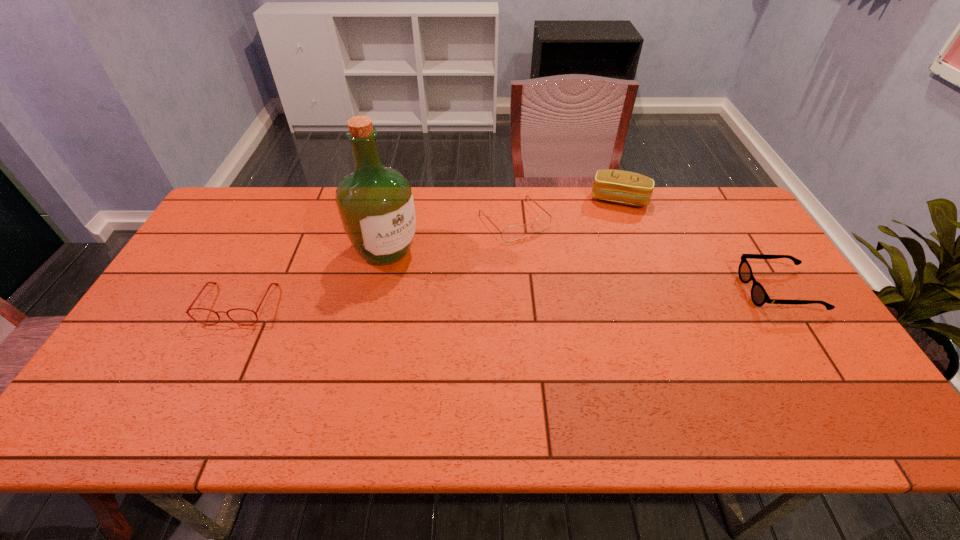
You are a GUI agent. You are given a task and a screenshot of the screen. Output one action in this format:
    pyautogui.click(x=<x>, y=<y>)
    Task: Click on the free region located 0.370m on the arms of the rightmost spectacles
    
    Given the screenshot: What is the action you would take?
    pyautogui.click(x=614, y=291)

Where is `vacant space positioned 0.260m on the arms of the rightmost spectacles`? Image resolution: width=960 pixels, height=540 pixels. vacant space positioned 0.260m on the arms of the rightmost spectacles is located at coordinates (654, 291).

Locate an element on the screen. This screenshot has width=960, height=540. free location located 0.080m on the front-facing side of the third object from right to left is located at coordinates (546, 255).

Image resolution: width=960 pixels, height=540 pixels. I want to click on blank space located 0.180m on the front-facing side of the third object from right to left, so click(x=565, y=276).

Where is `vacant space located 0.070m on the front-facing side of the third object from right to left`? This screenshot has height=540, width=960. vacant space located 0.070m on the front-facing side of the third object from right to left is located at coordinates (545, 253).

You are a GUI agent. You are given a task and a screenshot of the screen. Output one action in this format:
    pyautogui.click(x=<x>, y=<y>)
    Task: Click on the vacant space located 0.270m on the front-facing side of the tallest object
    
    Given the screenshot: What is the action you would take?
    (x=470, y=318)

Locate an element on the screen. Image resolution: width=960 pixels, height=540 pixels. blank space located on the front-facing side of the tallest object is located at coordinates click(x=484, y=329).

Where is `vacant space located on the front-facing side of the tallest object`? The width and height of the screenshot is (960, 540). vacant space located on the front-facing side of the tallest object is located at coordinates (420, 278).

At what (x,y) coordinates should I click in order to perform the action: click on free space located on the zipper side of the second tallest object. Please return your answer as a coordinate pair (x, y). The width and height of the screenshot is (960, 540). Looking at the image, I should click on (607, 233).

This screenshot has width=960, height=540. In order to click on vacant space located 0.210m on the zipper side of the second tallest object in this screenshot , I will do `click(602, 250)`.